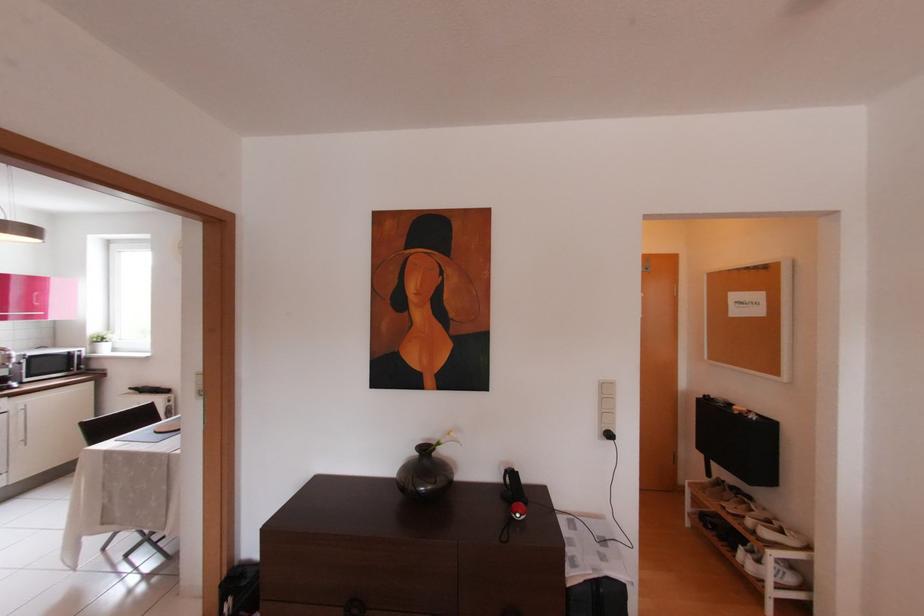
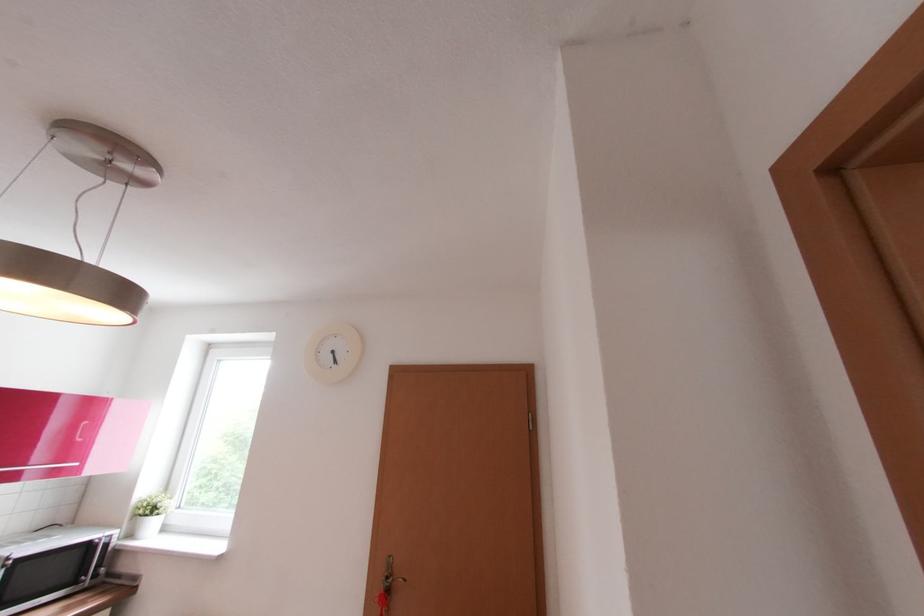
Find the pixel in the second image that matches (38,318) in the first image.

(62, 472)